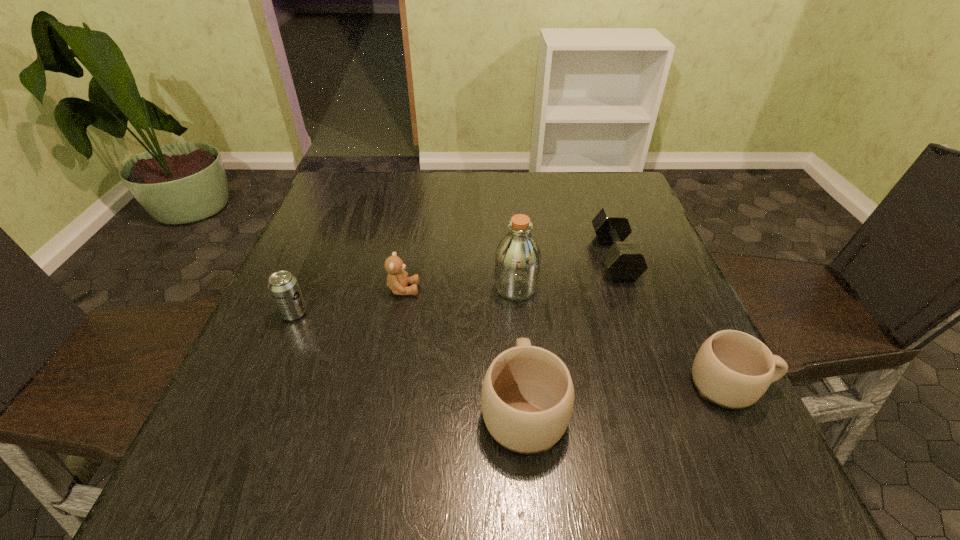
The width and height of the screenshot is (960, 540). What are the coordinates of `the taller mug` in the screenshot? It's located at (527, 398).

At what (x,y) coordinates should I click in order to perform the action: click on the right mug. Please return your answer as a coordinate pair (x, y). Image resolution: width=960 pixels, height=540 pixels. Looking at the image, I should click on (732, 369).

What are the coordinates of `the shorter mug` in the screenshot? It's located at (732, 369).

This screenshot has height=540, width=960. Find the location of `bottle`. bottle is located at coordinates (518, 257).

You are a GUI agent. You are given a task and a screenshot of the screen. Output one action in this format:
    pyautogui.click(x=<x>, y=<y>)
    Task: Click on the teddy bear
    The image size is (960, 540).
    Given the screenshot: What is the action you would take?
    pyautogui.click(x=397, y=280)

Where is `the fourth farthest object`? Image resolution: width=960 pixels, height=540 pixels. the fourth farthest object is located at coordinates (283, 286).

Locate an element on the screen. the leftmost object is located at coordinates (283, 286).

Locate an element on the screen. The image size is (960, 540). dumbbell is located at coordinates (625, 262).

Image resolution: width=960 pixels, height=540 pixels. What are the coordinates of `free region located 0.380m on the side of the left mug with the handle` in the screenshot? It's located at (510, 240).

Identify the location of vacant space located 0.060m on the side of the left mug with the handle. The image size is (960, 540). (518, 338).